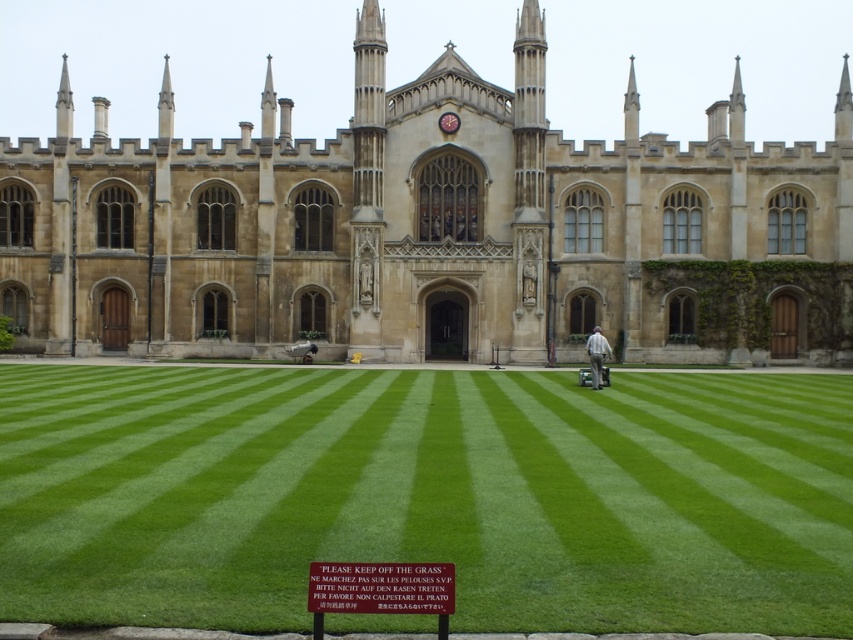
Question: Estimate the real-world distances between objects in this image. Which object is farther from the light gray fabric at center?

Choices:
 (A) brown stone gothic at center
 (B) green smooth lawn at center

Answer: (A)

Question: Which of these objects is positioned farthest from the brown stone gothic at center?

Choices:
 (A) light gray fabric at center
 (B) green smooth lawn at center

Answer: (A)

Question: Where is brown stone gothic at center located in relation to green smooth lawn at center in the image?

Choices:
 (A) below
 (B) above

Answer: (B)

Question: Which of the following is the closest to the observer?

Choices:
 (A) (463, 378)
 (B) (593, 356)
 (C) (747, 154)

Answer: (B)

Question: Is green smooth lawn at center to the left of light gray fabric at center from the viewer's perspective?

Choices:
 (A) yes
 (B) no

Answer: (A)

Question: Can you confirm if brown stone gothic at center is bigger than green smooth lawn at center?

Choices:
 (A) no
 (B) yes

Answer: (B)